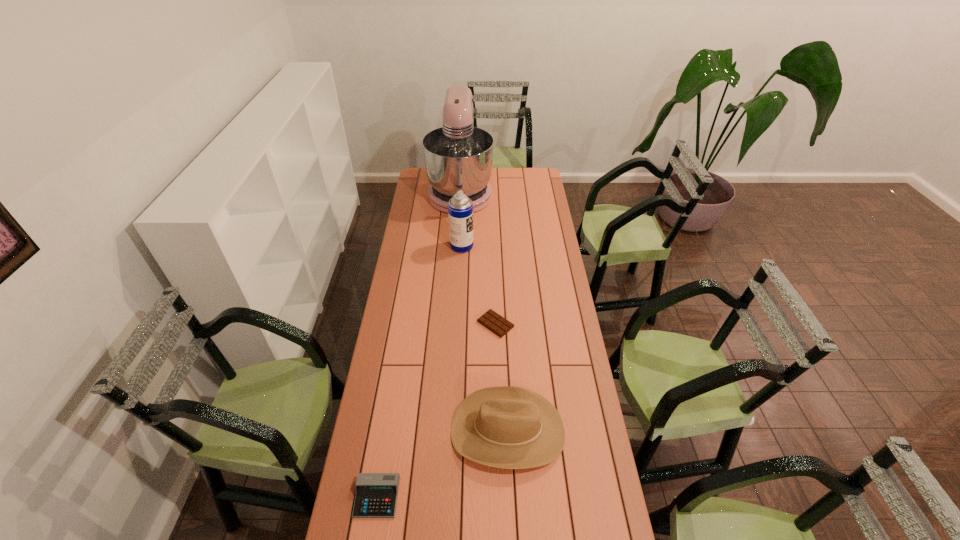
Identify the location of free area in between the nearest object and the cowboy hat. (443, 464).

Locate an element on the screen. This screenshot has width=960, height=540. blank region between the aerosol can and the nearest object is located at coordinates (420, 372).

Identify which object is the fourth closest to the second tallest object. Please provide its 2D coordinates. Your answer should be formatted as a tuple, i.e. [(x, y)], where the tuple contains the x and y coordinates of a point satisfying the conditions above.

[(376, 495)]

Locate which object ranks in proximity to the calculator. Please provide its 2D coordinates. Your answer should be formatted as a tuple, i.e. [(x, y)], where the tuple contains the x and y coordinates of a point satisfying the conditions above.

[(509, 427)]

I want to click on free spot that satisfies the following two spatial constraints: 1. on the label side of the second tallest object; 2. on the front side of the second shortest object, so click(450, 497).

The image size is (960, 540). In order to click on free space in the image that satisfies the following two spatial constraints: 1. on the front-facing side of the mixer; 2. on the left side of the cowboy hat in this screenshot , I will do `click(446, 430)`.

In order to click on vacant region that satisfies the following two spatial constraints: 1. on the front side of the third shortest object; 2. on the right side of the third farthest object in this screenshot , I will do `click(499, 430)`.

The height and width of the screenshot is (540, 960). Identify the location of vacant region that satisfies the following two spatial constraints: 1. on the front-facing side of the mixer; 2. on the left side of the third shortest object. (446, 430).

The height and width of the screenshot is (540, 960). I want to click on vacant point that satisfies the following two spatial constraints: 1. on the back side of the candy bar; 2. on the right side of the nearest object, so click(405, 324).